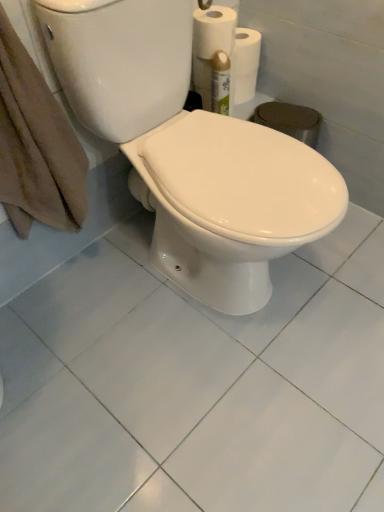
Image resolution: width=384 pixels, height=512 pixels. Identify the location of vacant space underneath brown cotton towel at left (from a real-world perspective). (84, 275).